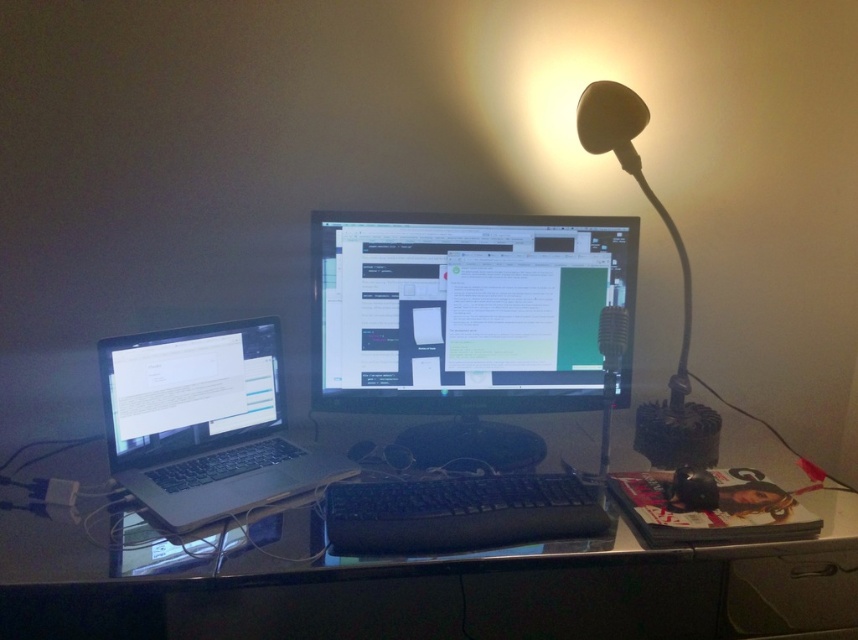
You need to place a mouse between the two devices, the black glossy monitor at center and the satin black laptop at left. Which side of the monitor should you place it so it doesn

The black glossy monitor at center is wider than the satin black laptop at left, so placing the mouse to the right of the monitor would ensure it is within reach of both devices.

You are a delivery person who just delivered a new keyboard that is 10 inches long. You need to place it between the black glossy monitor at center and the silver metallic laptop at left. Can you fit it there without overlapping either device?

The distance between the black glossy monitor at center and the silver metallic laptop at left is 9.82 inches. Since the keyboard is 10 inches long, it cannot fit between them without overlapping one of the devices.

In the scene shown: You are setting up a new desk arrangement and want to place a plant between the silver metallic laptop at left and the satin black laptop at left. However, you notice something unusual about their positions. What is the issue with placing a plant between them?

The silver metallic laptop at left is below the satin black laptop at left, meaning they are stacked vertically. Therefore, there is no horizontal space between them to place a plant.